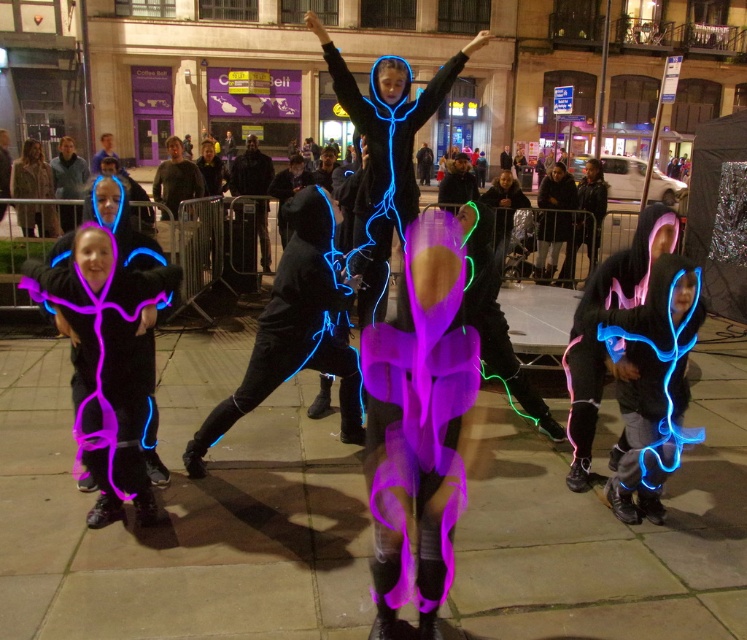
Question: Which of the following is the closest to the observer?

Choices:
 (A) (278, 284)
 (B) (598, 380)

Answer: (B)

Question: Where is neon blue fabric at center located in relation to neon purple fabric at center in the image?

Choices:
 (A) left
 (B) right

Answer: (A)

Question: Is neon blue fabric at center positioned before neon purple fabric at center?

Choices:
 (A) no
 (B) yes

Answer: (A)

Question: Is neon blue fabric at center wider than neon purple fabric at center?

Choices:
 (A) yes
 (B) no

Answer: (A)